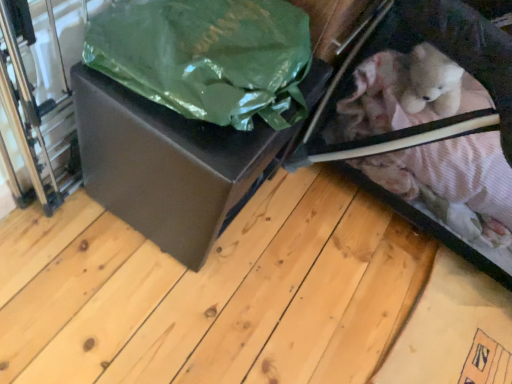
Question: From a real-world perspective, is green matte plastic bag at upper left physically below velvet pink fabric baby carriage at lower right?

Choices:
 (A) no
 (B) yes

Answer: (A)

Question: Would you say green matte plastic bag at upper left is a long distance from velvet pink fabric baby carriage at lower right?

Choices:
 (A) no
 (B) yes

Answer: (A)

Question: Is green matte plastic bag at upper left thinner than velvet pink fabric baby carriage at lower right?

Choices:
 (A) no
 (B) yes

Answer: (B)

Question: From the image's perspective, would you say green matte plastic bag at upper left is shown under velvet pink fabric baby carriage at lower right?

Choices:
 (A) yes
 (B) no

Answer: (B)

Question: Considering the relative sizes of green matte plastic bag at upper left and velvet pink fabric baby carriage at lower right in the image provided, is green matte plastic bag at upper left bigger than velvet pink fabric baby carriage at lower right?

Choices:
 (A) yes
 (B) no

Answer: (B)

Question: From a real-world perspective, relative to matte black box at center, is velvet pink fabric baby carriage at lower right vertically above or below?

Choices:
 (A) above
 (B) below

Answer: (A)

Question: Looking at their shapes, would you say velvet pink fabric baby carriage at lower right is wider or thinner than matte black box at center?

Choices:
 (A) wide
 (B) thin

Answer: (A)

Question: Does point (x=414, y=23) appear closer or farther from the camera than point (x=99, y=185)?

Choices:
 (A) closer
 (B) farther

Answer: (A)

Question: From the image's perspective, is velvet pink fabric baby carriage at lower right positioned above or below matte black box at center?

Choices:
 (A) above
 (B) below

Answer: (A)

Question: From the image's perspective, is green matte plastic bag at upper left positioned above or below velvet pink fabric baby carriage at lower right?

Choices:
 (A) below
 (B) above

Answer: (B)

Question: In terms of size, does green matte plastic bag at upper left appear bigger or smaller than velvet pink fabric baby carriage at lower right?

Choices:
 (A) small
 (B) big

Answer: (A)

Question: In the image, is green matte plastic bag at upper left on the left side or the right side of velvet pink fabric baby carriage at lower right?

Choices:
 (A) left
 (B) right

Answer: (A)

Question: From a real-world perspective, is green matte plastic bag at upper left positioned above or below velvet pink fabric baby carriage at lower right?

Choices:
 (A) above
 (B) below

Answer: (A)

Question: Relative to matte black box at center, is green matte plastic bag at upper left in front or behind?

Choices:
 (A) front
 (B) behind

Answer: (A)

Question: In the image, is green matte plastic bag at upper left on the left side or the right side of matte black box at center?

Choices:
 (A) right
 (B) left

Answer: (A)